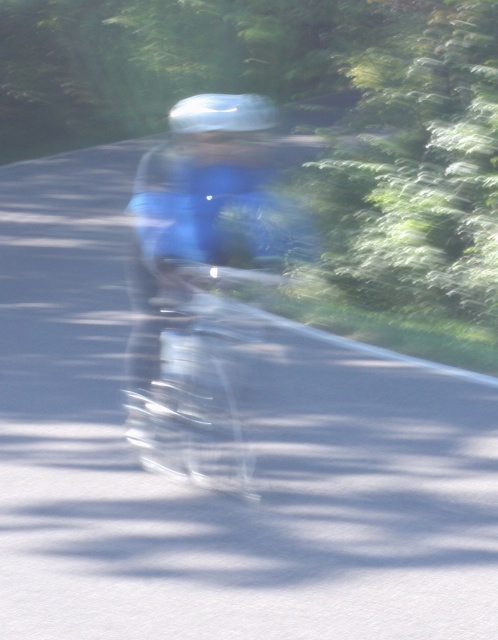
Who is more forward, (206,342) or (268,122)?

Point (206,342) is more forward.

What are the coordinates of `clear plastic bicycle at center` in the screenshot? It's located at (195, 384).